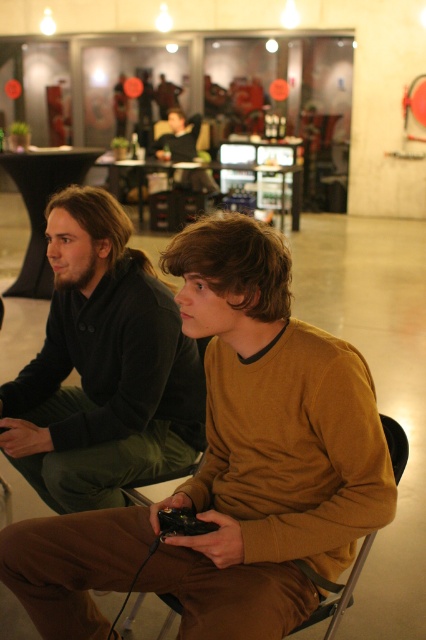
You are a delivery robot with a 35 cm wide package. You need to place the package between the brown cotton shirt at center and the metallic silver chair at center. Is there enough space?

The distance between the brown cotton shirt at center and the metallic silver chair at center is 34.87 centimeters. Since the package is 35 cm wide, there isn not enough space to place the package between them.

You are a photographer trying to capture a candid shot of the two gamers. You notice the brown cotton shirt at center and the metallic silver chair at center. Which object should you focus on first if you want to photograph the one closer to the left side?

The brown cotton shirt at center is to the left of the metallic silver chair at center, so you should focus on the brown cotton shirt at center first as it is closer to the left side.

You are organizing a photo shoot and need to ensure that the two participants are positioned so that their shirts do not overlap. Given that the brown cotton shirt at center and the brown matte sweater at center are both in the frame, which shirt should be moved to the left to prevent overlap?

The brown cotton shirt at center should be moved to the left because it might be wider than the brown matte sweater at center, reducing the chance of overlap.